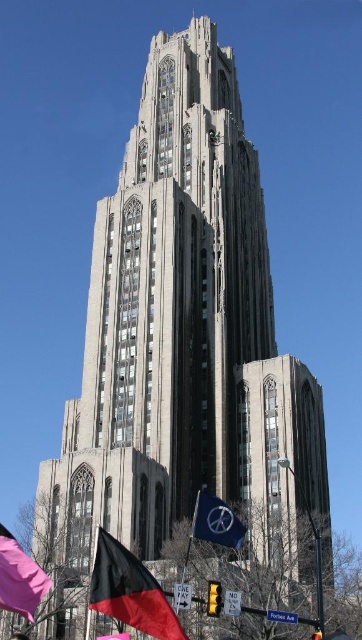
You are standing in front of the Gothic building and see the black fabric flag at lower left and the blue fabric flag at lower center. Which flag is located more to the left?

The black fabric flag at lower left is more to the left side of the blue fabric flag at lower center.

You are a photographer planning to capture the Gothic building while ensuring both the matte pink flag at lower left and the blue fabric flag at lower center are visible in the frame. Given their sizes, which flag might require you to adjust your camera angle to include its entirety?

The matte pink flag at lower left is larger in size than the blue fabric flag at lower center, so you might need to adjust your camera angle to include the entirety of the matte pink flag at lower left.

You are a photographer standing at the base of the Gothic building and want to capture both the black fabric flag at lower left and the pink flag in the scene. What is the minimum distance you need to move backward to ensure both flags are in frame?

The minimum distance you need to move backward to ensure both the black fabric flag at lower left and the pink flag in the scene are in frame is 71.85 feet.